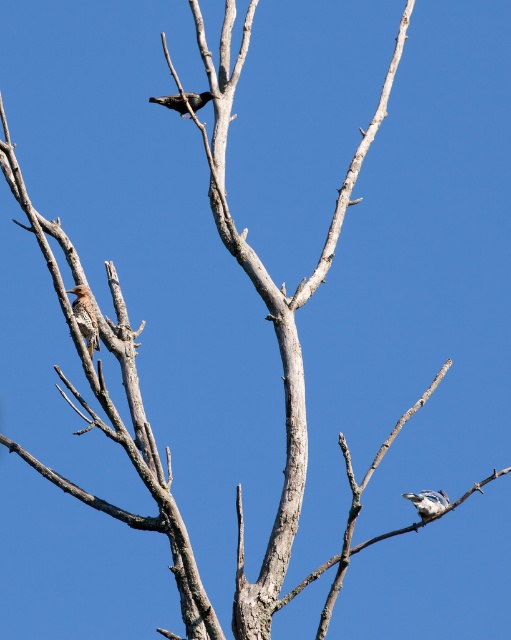
Which of these two, blue glossy bird at lower right or shiny black bird at upper center, stands shorter?

blue glossy bird at lower right is shorter.

Looking at this image, is blue glossy bird at lower right to the left of shiny black bird at upper center from the viewer's perspective?

In fact, blue glossy bird at lower right is to the right of shiny black bird at upper center.

What do you see at coordinates (428, 500) in the screenshot? I see `blue glossy bird at lower right` at bounding box center [428, 500].

This screenshot has height=640, width=511. I want to click on blue glossy bird at lower right, so click(428, 500).

Can you confirm if speckled brown bird at left is positioned below blue glossy bird at lower right?

No, speckled brown bird at left is not below blue glossy bird at lower right.

Which of these two, speckled brown bird at left or blue glossy bird at lower right, stands shorter?

With less height is blue glossy bird at lower right.

Which is in front, point (82, 298) or point (410, 493)?

Point (82, 298) is in front.

The image size is (511, 640). What are the coordinates of `speckled brown bird at left` in the screenshot? It's located at (85, 317).

Who is shorter, speckled brown bird at left or shiny black bird at upper center?

speckled brown bird at left

Is point (77, 301) more distant than point (169, 104)?

No, (77, 301) is in front of (169, 104).

Which is in front, point (90, 337) or point (196, 96)?

Point (90, 337)

Locate an element on the screen. speckled brown bird at left is located at coordinates (85, 317).